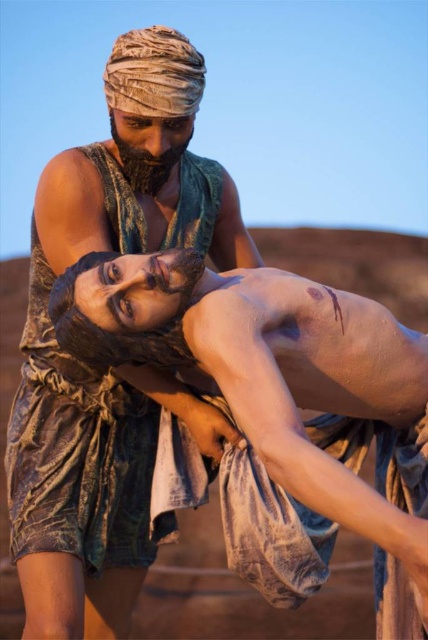
Which of these two, smooth skin wrestler at center or brown textured cloth at center, stands taller?

brown textured cloth at center is taller.

Who is more forward, (418, 540) or (94, 152)?

Positioned in front is point (418, 540).

This screenshot has height=640, width=428. What are the coordinates of `smooth skin wrestler at center` in the screenshot? It's located at (281, 410).